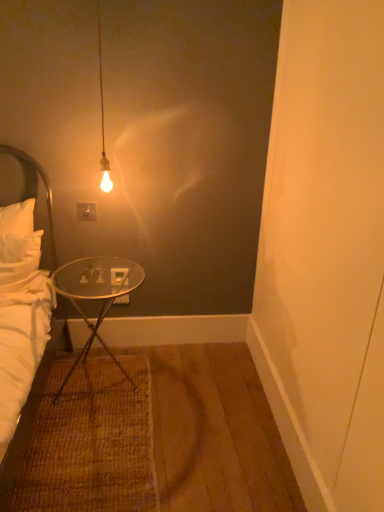
Question: From a real-world perspective, is white soft bed at left physically below white plastic power outlet at upper center?

Choices:
 (A) yes
 (B) no

Answer: (A)

Question: From the image's perspective, would you say white soft bed at left is positioned over white plastic power outlet at upper center?

Choices:
 (A) no
 (B) yes

Answer: (A)

Question: From a real-world perspective, is white soft bed at left located higher than white plastic power outlet at upper center?

Choices:
 (A) no
 (B) yes

Answer: (A)

Question: Is white soft bed at left positioned behind white plastic power outlet at upper center?

Choices:
 (A) yes
 (B) no

Answer: (B)

Question: Is white soft bed at left far from white plastic power outlet at upper center?

Choices:
 (A) yes
 (B) no

Answer: (B)

Question: Relative to white soft bed at left, is white plastic power outlet at upper center in front or behind?

Choices:
 (A) front
 (B) behind

Answer: (B)

Question: Visually, is white plastic power outlet at upper center positioned to the left or to the right of white soft bed at left?

Choices:
 (A) right
 (B) left

Answer: (A)

Question: In terms of width, does white plastic power outlet at upper center look wider or thinner when compared to white soft bed at left?

Choices:
 (A) thin
 (B) wide

Answer: (A)

Question: Considering the positions of point (89, 214) and point (28, 201), is point (89, 214) closer or farther from the camera than point (28, 201)?

Choices:
 (A) closer
 (B) farther

Answer: (B)

Question: Is white plastic power outlet at upper center taller or shorter than transparent glass table at lower left?

Choices:
 (A) short
 (B) tall

Answer: (A)

Question: Which is correct: white plastic power outlet at upper center is inside transparent glass table at lower left, or outside of it?

Choices:
 (A) outside
 (B) inside

Answer: (A)

Question: Visually, is white plastic power outlet at upper center positioned to the left or to the right of transparent glass table at lower left?

Choices:
 (A) right
 (B) left

Answer: (B)

Question: In the image, is white plastic power outlet at upper center positioned in front of or behind transparent glass table at lower left?

Choices:
 (A) front
 (B) behind

Answer: (B)

Question: In terms of width, does white fabric headboard at left look wider or thinner when compared to white soft bed at left?

Choices:
 (A) wide
 (B) thin

Answer: (B)

Question: Relative to white soft bed at left, is white fabric headboard at left in front or behind?

Choices:
 (A) front
 (B) behind

Answer: (B)